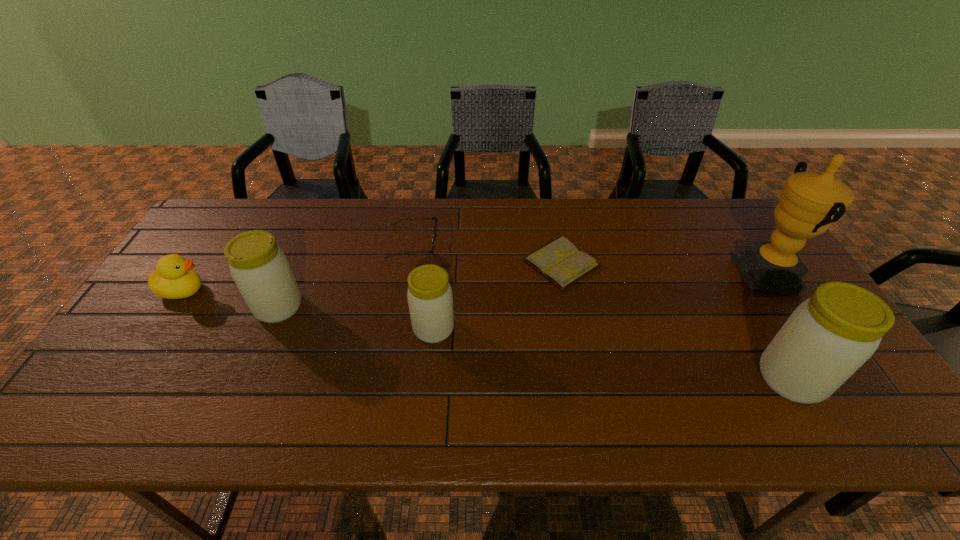
If equal spacing is the goal by inserting an additional jar among them, please point out a vacant space for this new jar. Please provide its 2D coordinates. Your answer should be formatted as a tuple, i.e. [(x, y)], where the tuple contains the x and y coordinates of a point satisfying the conditions above.

[(604, 353)]